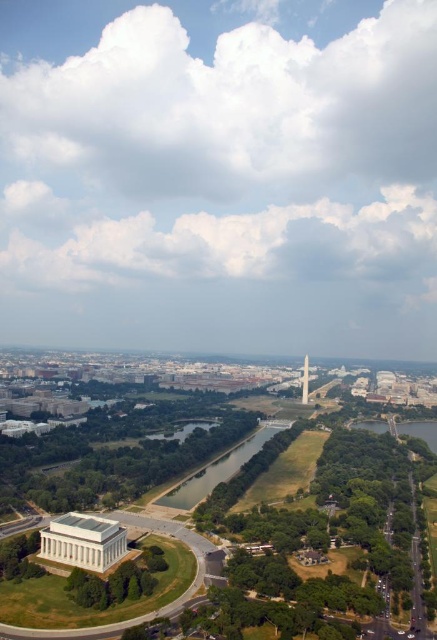
Who is shorter, green grassy field at center or white marble obelisk at center?

green grassy field at center is shorter.

Where is `green grassy field at center`? green grassy field at center is located at coordinates coord(218,468).